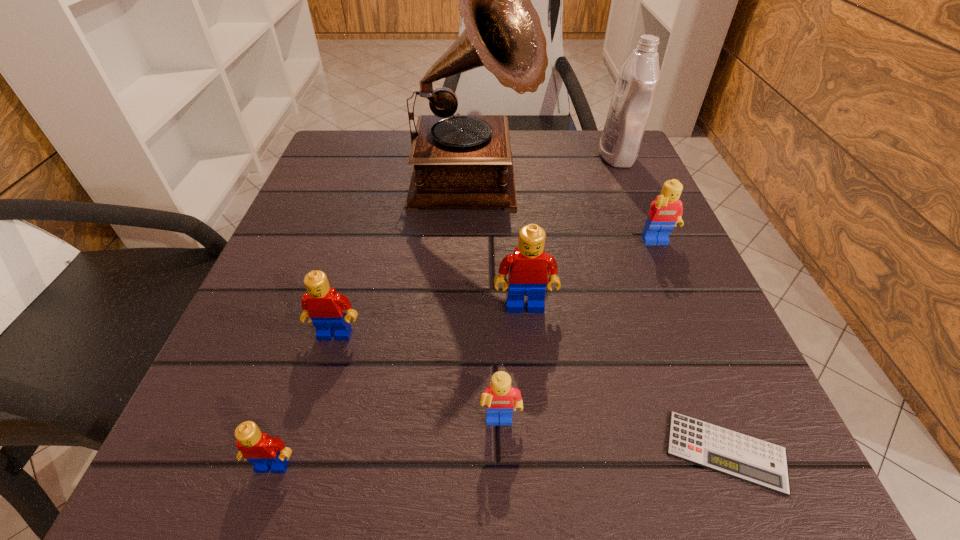
Locate an element on the screen. vacant space located on the face of the second nearest Lego is located at coordinates (503, 493).

The height and width of the screenshot is (540, 960). I want to click on vacant area located on the left of the shortest object, so click(578, 451).

Locate an element on the screen. record player present at the far edge is located at coordinates (459, 161).

You are a GUI agent. You are given a task and a screenshot of the screen. Output one action in this format:
    pyautogui.click(x=<x>, y=<y>)
    Task: Click on the detergent present at the far edge
    
    Given the screenshot: What is the action you would take?
    pyautogui.click(x=635, y=90)

I want to click on calculator that is at the near edge, so click(740, 456).

Where is `detergent located in the right edge section of the desktop`? This screenshot has height=540, width=960. detergent located in the right edge section of the desktop is located at coordinates [635, 90].

Locate an element on the screen. Lego situated at the right edge is located at coordinates (665, 212).

Identify the location of calculator at the right edge. This screenshot has width=960, height=540. (740, 456).

Where is `object that is at the near left corner`? The image size is (960, 540). object that is at the near left corner is located at coordinates (266, 454).

The width and height of the screenshot is (960, 540). I want to click on object that is at the far right corner, so (635, 90).